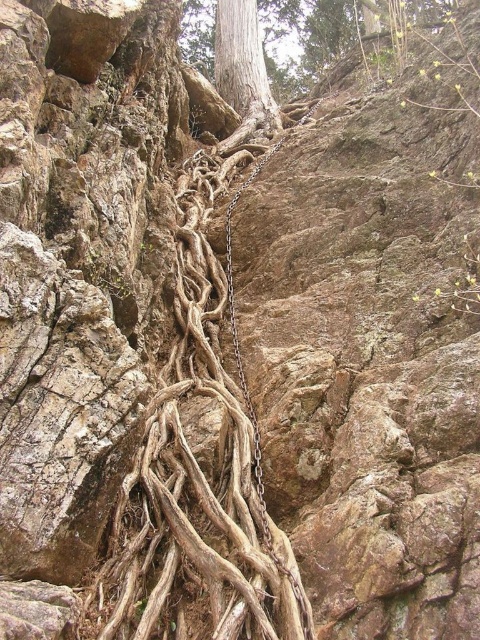
Question: Observing the image, what is the correct spatial positioning of brown rough tree roots at center in reference to smooth gray tree trunk at upper center?

Choices:
 (A) left
 (B) right

Answer: (A)

Question: Is brown rough tree roots at center positioned before smooth gray tree trunk at upper center?

Choices:
 (A) no
 (B) yes

Answer: (B)

Question: Which object is the farthest from the brown rough tree roots at center?

Choices:
 (A) metallic chain at center
 (B) smooth gray tree trunk at upper center

Answer: (B)

Question: Which of the following is the farthest from the observer?

Choices:
 (A) brown rough tree roots at center
 (B) smooth gray tree trunk at upper center

Answer: (B)

Question: Is brown rough tree roots at center above smooth gray tree trunk at upper center?

Choices:
 (A) no
 (B) yes

Answer: (A)

Question: Which object appears farthest from the camera in this image?

Choices:
 (A) brown rough tree roots at center
 (B) metallic chain at center

Answer: (B)